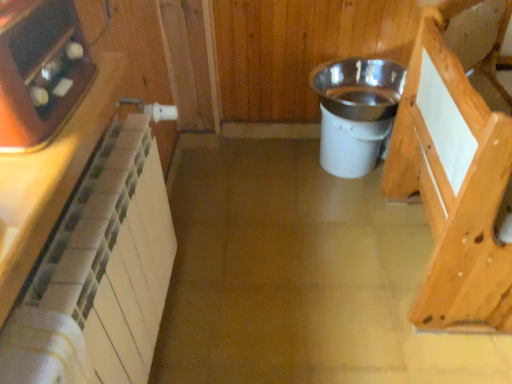
The height and width of the screenshot is (384, 512). Describe the element at coordinates (50, 179) in the screenshot. I see `white tile cabinetry at left, placed as the second cabinetry when sorted from right to left` at that location.

This screenshot has width=512, height=384. Identify the location of white plastic bucket at center, the second appliance in the left-to-right sequence. (355, 111).

From the image's perspective, is matte black tray at upper left, arranged as the second appliance when viewed from the back, located beneath white plastic bucket at center, marked as the 1th appliance in a right-to-left arrangement?

Yes, from the image's perspective, matte black tray at upper left, arranged as the second appliance when viewed from the back, is below white plastic bucket at center, marked as the 1th appliance in a right-to-left arrangement.

Does matte black tray at upper left, arranged as the first appliance when viewed from the left, turn towards white plastic bucket at center, which is counted as the 1th appliance, starting from the back?

No.

Based on the photo, considering the relative sizes of matte black tray at upper left, arranged as the first appliance when viewed from the left, and white plastic bucket at center, the second appliance in the left-to-right sequence, in the image provided, is matte black tray at upper left, arranged as the first appliance when viewed from the left, taller than white plastic bucket at center, the second appliance in the left-to-right sequence,?

Incorrect, the height of matte black tray at upper left, arranged as the first appliance when viewed from the left, is not larger of that of white plastic bucket at center, the second appliance in the left-to-right sequence.

Which of these two, matte black tray at upper left, the 2th appliance from the right, or white plastic bucket at center, the 2th appliance when ordered from front to back, is thinner?

With smaller width is matte black tray at upper left, the 2th appliance from the right.

Which is in front, light brown wood at right, the 1th cabinetry viewed from the right, or white tile cabinetry at left, placed as the 1th cabinetry when sorted from front to back?

Answer: white tile cabinetry at left, placed as the 1th cabinetry when sorted from front to back, is closer to the camera.

Is light brown wood at right, which ranks as the second cabinetry in left-to-right order, thinner than white tile cabinetry at left, which ranks as the second cabinetry in back-to-front order?

Incorrect, the width of light brown wood at right, which ranks as the second cabinetry in left-to-right order, is not less than that of white tile cabinetry at left, which ranks as the second cabinetry in back-to-front order.

From the image's perspective, is light brown wood at right, which ranks as the second cabinetry in left-to-right order, on white tile cabinetry at left, placed as the second cabinetry when sorted from right to left?

Yes, from the image's perspective, light brown wood at right, which ranks as the second cabinetry in left-to-right order, is on top of white tile cabinetry at left, placed as the second cabinetry when sorted from right to left.

Could you tell me if light brown wood at right, positioned as the 1th cabinetry in back-to-front order, is turned towards white tile cabinetry at left, which ranks as the first cabinetry in left-to-right order?

No, light brown wood at right, positioned as the 1th cabinetry in back-to-front order, is not aimed at white tile cabinetry at left, which ranks as the first cabinetry in left-to-right order.

Can you tell me how much white plastic bucket at center, marked as the 1th appliance in a right-to-left arrangement, and matte black tray at upper left, arranged as the second appliance when viewed from the back, differ in facing direction?

There is a 85.5-degree angle between the facing directions of white plastic bucket at center, marked as the 1th appliance in a right-to-left arrangement, and matte black tray at upper left, arranged as the second appliance when viewed from the back.

Is white plastic bucket at center, which is counted as the 1th appliance, starting from the back, touching matte black tray at upper left, the 2th appliance from the right?

white plastic bucket at center, which is counted as the 1th appliance, starting from the back, and matte black tray at upper left, the 2th appliance from the right, are clearly separated.

From the picture: Which of these two, white plastic bucket at center, the second appliance in the left-to-right sequence, or matte black tray at upper left, arranged as the second appliance when viewed from the back, stands shorter?

matte black tray at upper left, arranged as the second appliance when viewed from the back, is shorter.

From a real-world perspective, is light brown wood at right, positioned as the 1th cabinetry in back-to-front order, under matte black tray at upper left, acting as the first appliance starting from the front?

Yes, from a real-world perspective, light brown wood at right, positioned as the 1th cabinetry in back-to-front order, is under matte black tray at upper left, acting as the first appliance starting from the front.

Can you confirm if light brown wood at right, which ranks as the second cabinetry in left-to-right order, is shorter than matte black tray at upper left, the 2th appliance from the right?

In fact, light brown wood at right, which ranks as the second cabinetry in left-to-right order, may be taller than matte black tray at upper left, the 2th appliance from the right.

From the image's perspective, between light brown wood at right, which ranks as the second cabinetry in left-to-right order, and matte black tray at upper left, acting as the first appliance starting from the front, which one is located above?

From the image's view, matte black tray at upper left, acting as the first appliance starting from the front, is above.

Is point (467, 312) closer to camera compared to point (7, 47)?

That is False.

Are light brown wood at right, positioned as the 1th cabinetry in back-to-front order, and white plastic bucket at center, marked as the 1th appliance in a right-to-left arrangement, located far from each other?

No, light brown wood at right, positioned as the 1th cabinetry in back-to-front order, is not far from white plastic bucket at center, marked as the 1th appliance in a right-to-left arrangement.

From the image's perspective, which object appears higher, light brown wood at right, which ranks as the second cabinetry in left-to-right order, or white plastic bucket at center, marked as the 1th appliance in a right-to-left arrangement?

white plastic bucket at center, marked as the 1th appliance in a right-to-left arrangement, appears higher in the image.

At what (x,y) coordinates should I click in order to perform the action: click on cabinetry on the right of white plastic bucket at center, which is counted as the 1th appliance, starting from the back. Please return your answer as a coordinate pair (x, y). The width and height of the screenshot is (512, 384). Looking at the image, I should click on (458, 163).

Which of these two, light brown wood at right, which ranks as the second cabinetry in left-to-right order, or white plastic bucket at center, which is counted as the 1th appliance, starting from the back, is bigger?

light brown wood at right, which ranks as the second cabinetry in left-to-right order.

Does point (9, 305) lie in front of point (424, 64)?

Yes, it is in front of point (424, 64).

Which of these two, white tile cabinetry at left, placed as the 1th cabinetry when sorted from front to back, or light brown wood at right, which ranks as the second cabinetry in left-to-right order, stands shorter?

With less height is white tile cabinetry at left, placed as the 1th cabinetry when sorted from front to back.

Is white tile cabinetry at left, which ranks as the second cabinetry in back-to-front order, smaller than light brown wood at right, positioned as the 1th cabinetry in back-to-front order?

Indeed, white tile cabinetry at left, which ranks as the second cabinetry in back-to-front order, has a smaller size compared to light brown wood at right, positioned as the 1th cabinetry in back-to-front order.

Find the location of a particular element. cabinetry that is on the left side of light brown wood at right, the 1th cabinetry viewed from the right is located at coordinates (50, 179).

From the image's perspective, does white plastic bucket at center, the second appliance in the left-to-right sequence, appear lower than white tile cabinetry at left, placed as the second cabinetry when sorted from right to left?

No, from the image's perspective, white plastic bucket at center, the second appliance in the left-to-right sequence, is not beneath white tile cabinetry at left, placed as the second cabinetry when sorted from right to left.

Is white plastic bucket at center, which is counted as the 1th appliance, starting from the back, bigger or smaller than white tile cabinetry at left, placed as the second cabinetry when sorted from right to left?

Considering their sizes, white plastic bucket at center, which is counted as the 1th appliance, starting from the back, takes up more space than white tile cabinetry at left, placed as the second cabinetry when sorted from right to left.

From the picture: Which point is more distant from viewer, (370, 114) or (89, 104)?

The point (370, 114) is more distant.

Locate an element on the screen. The image size is (512, 384). appliance below the white plastic bucket at center, which is counted as the 1th appliance, starting from the back (from the image's perspective) is located at coordinates (40, 71).

Locate an element on the screen. cabinetry located above the white tile cabinetry at left, which ranks as the first cabinetry in left-to-right order (from the image's perspective) is located at coordinates (458, 163).

When comparing their distances from matte black tray at upper left, the 2th appliance from the right, does white plastic bucket at center, marked as the 1th appliance in a right-to-left arrangement, or light brown wood at right, positioned as the 1th cabinetry in back-to-front order, seem further?

white plastic bucket at center, marked as the 1th appliance in a right-to-left arrangement, lies further to matte black tray at upper left, the 2th appliance from the right, than the other object.

When comparing their distances from white plastic bucket at center, the second appliance in the left-to-right sequence, does matte black tray at upper left, the 2th appliance from the right, or light brown wood at right, the 1th cabinetry viewed from the right, seem further?

matte black tray at upper left, the 2th appliance from the right.

Considering their positions, is light brown wood at right, the 1th cabinetry viewed from the right, positioned further to white plastic bucket at center, the 2th appliance when ordered from front to back, than white tile cabinetry at left, which ranks as the first cabinetry in left-to-right order?

white tile cabinetry at left, which ranks as the first cabinetry in left-to-right order, is further to white plastic bucket at center, the 2th appliance when ordered from front to back.

From the image, which object appears to be nearer to white plastic bucket at center, which is counted as the 1th appliance, starting from the back, white tile cabinetry at left, which ranks as the second cabinetry in back-to-front order, or matte black tray at upper left, arranged as the first appliance when viewed from the left?

The object closer to white plastic bucket at center, which is counted as the 1th appliance, starting from the back, is white tile cabinetry at left, which ranks as the second cabinetry in back-to-front order.

Estimate the real-world distances between objects in this image. Which object is closer to white plastic bucket at center, which is counted as the 1th appliance, starting from the back, light brown wood at right, positioned as the 1th cabinetry in back-to-front order, or matte black tray at upper left, acting as the first appliance starting from the front?

light brown wood at right, positioned as the 1th cabinetry in back-to-front order.

When comparing their distances from white tile cabinetry at left, placed as the 1th cabinetry when sorted from front to back, does matte black tray at upper left, arranged as the first appliance when viewed from the left, or white plastic bucket at center, which is counted as the 1th appliance, starting from the back, seem further?

Among the two, white plastic bucket at center, which is counted as the 1th appliance, starting from the back, is located further to white tile cabinetry at left, placed as the 1th cabinetry when sorted from front to back.

When comparing their distances from white plastic bucket at center, marked as the 1th appliance in a right-to-left arrangement, does matte black tray at upper left, the 2th appliance from the right, or white tile cabinetry at left, placed as the 1th cabinetry when sorted from front to back, seem closer?

white tile cabinetry at left, placed as the 1th cabinetry when sorted from front to back, is closer to white plastic bucket at center, marked as the 1th appliance in a right-to-left arrangement.

Which object lies nearer to the anchor point light brown wood at right, acting as the 2th cabinetry starting from the front, matte black tray at upper left, arranged as the second appliance when viewed from the back, or white tile cabinetry at left, placed as the second cabinetry when sorted from right to left?

white tile cabinetry at left, placed as the second cabinetry when sorted from right to left.

Find the location of a particular element. The image size is (512, 384). appliance positioned between white tile cabinetry at left, which ranks as the second cabinetry in back-to-front order, and white plastic bucket at center, which is counted as the 1th appliance, starting from the back, from near to far is located at coordinates [40, 71].

I want to click on cabinetry between matte black tray at upper left, arranged as the first appliance when viewed from the left, and light brown wood at right, the 1th cabinetry viewed from the right, so click(50, 179).

Identify the location of cabinetry located between white tile cabinetry at left, placed as the second cabinetry when sorted from right to left, and white plastic bucket at center, the 2th appliance when ordered from front to back, in the depth direction. The width and height of the screenshot is (512, 384). (458, 163).

Identify the location of appliance situated between matte black tray at upper left, arranged as the first appliance when viewed from the left, and light brown wood at right, which ranks as the second cabinetry in left-to-right order, from left to right. This screenshot has width=512, height=384. (355, 111).